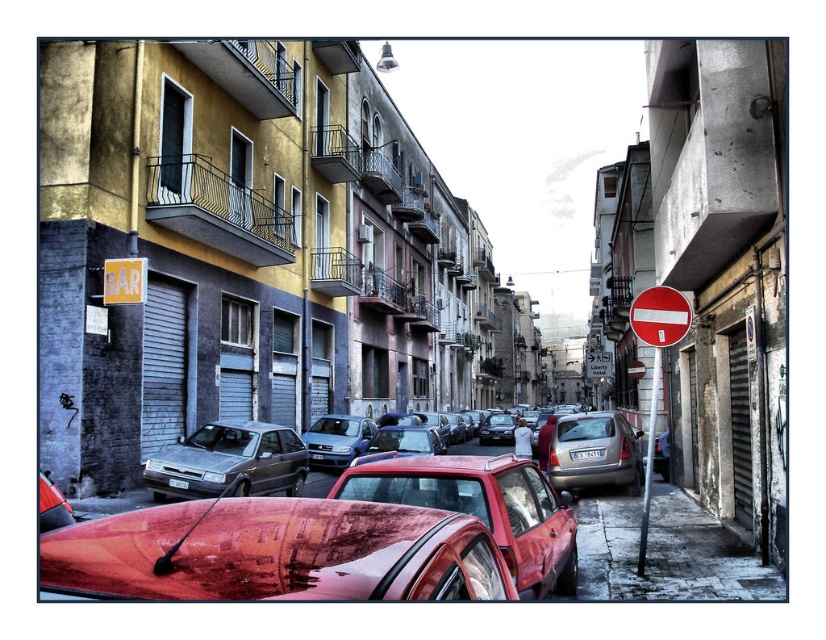
Is the position of silver metallic hatchback at center less distant than that of white plastic license plate at center?

No, it is not.

Is point (561, 490) farther from viewer compared to point (577, 458)?

That is False.

Identify the location of silver metallic hatchback at center. (594, 452).

Does red plastic sign at right have a greater width compared to metallic blue hatchback at center?

Indeed, red plastic sign at right has a greater width compared to metallic blue hatchback at center.

Who is more forward, (656, 342) or (307, 444)?

Positioned in front is point (656, 342).

Who is more forward, (644,556) or (311,452)?

Point (644,556) is in front.

You are a GUI agent. You are given a task and a screenshot of the screen. Output one action in this format:
    pyautogui.click(x=<x>, y=<y>)
    Task: Click on the red plastic sign at right
    This screenshot has width=826, height=640.
    Given the screenshot: What is the action you would take?
    656,368

Does rusty metallic car at center have a larger size compared to smooth concrete sidewalk at lower right?

Indeed, rusty metallic car at center has a larger size compared to smooth concrete sidewalk at lower right.

Between rusty metallic car at center and smooth concrete sidewalk at lower right, which one has more height?

rusty metallic car at center

The height and width of the screenshot is (640, 826). I want to click on rusty metallic car at center, so click(x=482, y=508).